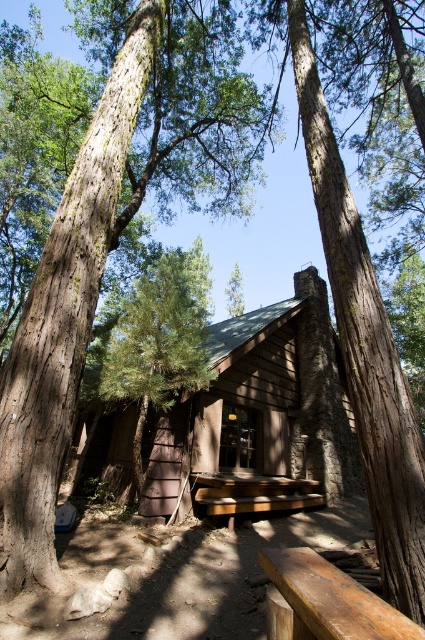
Question: Can you confirm if brown wooden cabin at center is positioned to the right of rustic wooden bench at center?

Choices:
 (A) no
 (B) yes

Answer: (B)

Question: Which point is farther to the camera?

Choices:
 (A) wooden picnic table at center
 (B) brown textured wood cabin at center
 (C) rustic wooden bench at center
 (D) brown wooden cabin at center

Answer: (D)

Question: Does green textured pine tree at center come in front of wooden picnic table at center?

Choices:
 (A) no
 (B) yes

Answer: (A)

Question: Which point appears closest to the camera in this image?

Choices:
 (A) (289, 346)
 (B) (421, 628)
 (C) (203, 193)

Answer: (B)

Question: Which object is the farthest from the brown wooden cabin at center?

Choices:
 (A) green textured pine tree at center
 (B) brown textured wood cabin at center

Answer: (A)

Question: Can you confirm if brown textured wood cabin at center is positioned below rustic wooden bench at center?

Choices:
 (A) yes
 (B) no

Answer: (B)